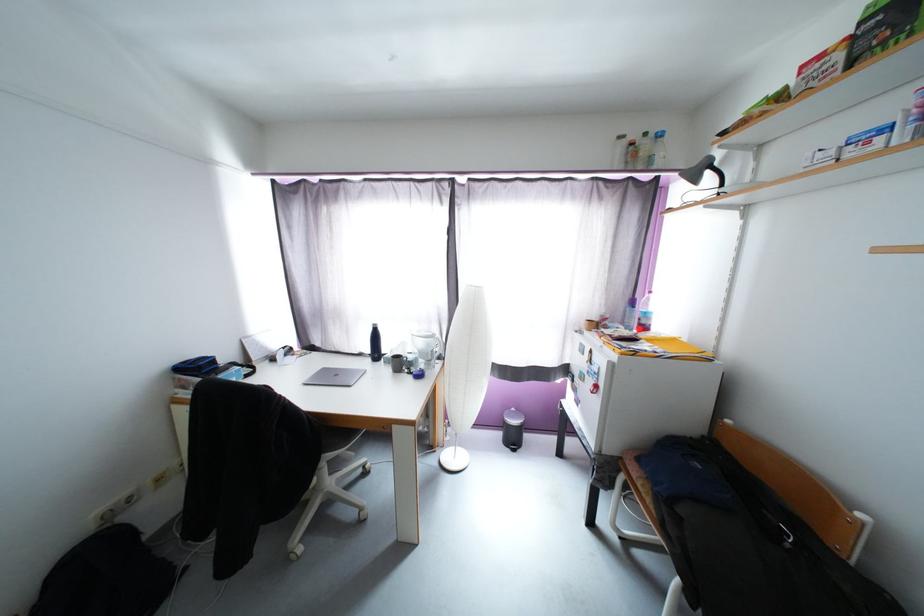
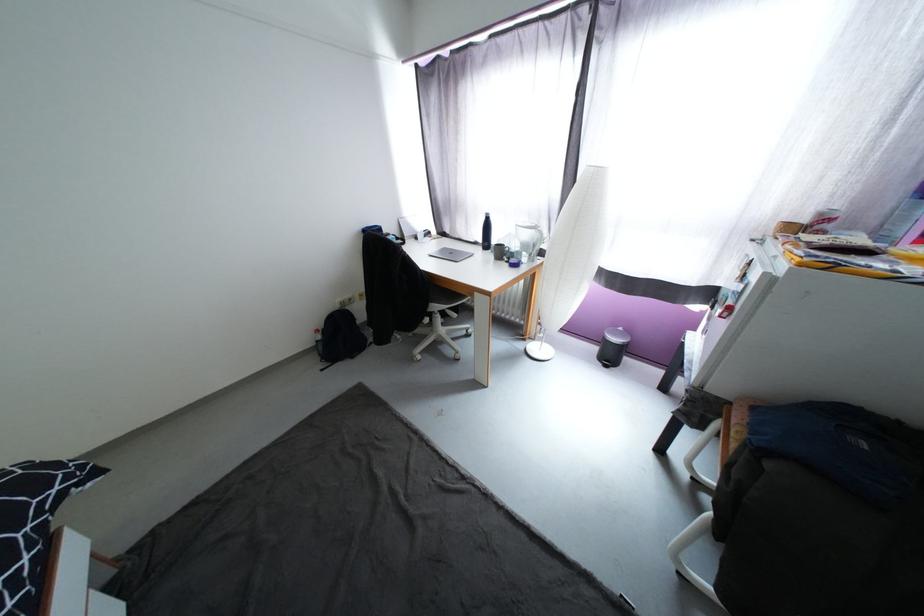
The first image is from the beginning of the video and the second image is from the end. How did the camera likely rotate when shooting the video?

The camera rotated toward left-down.